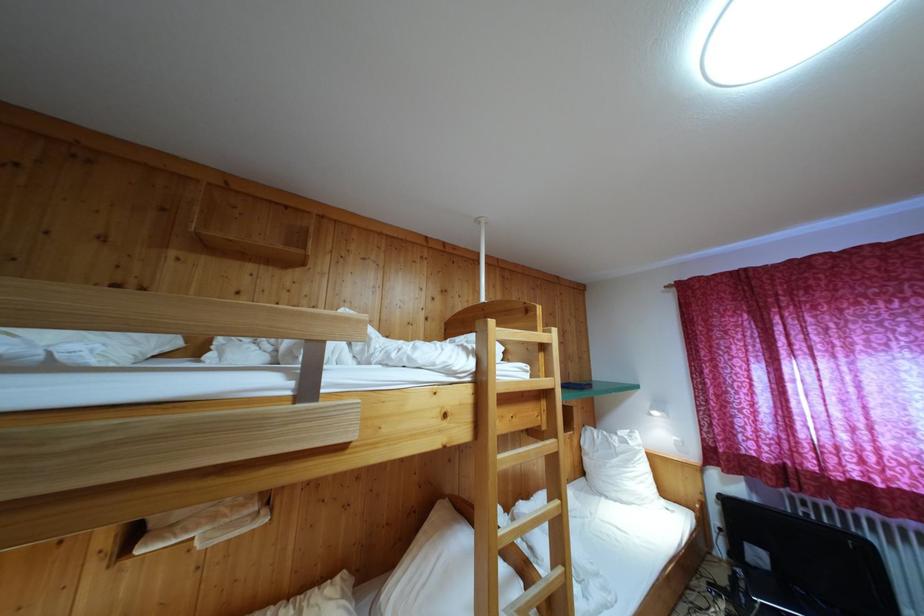
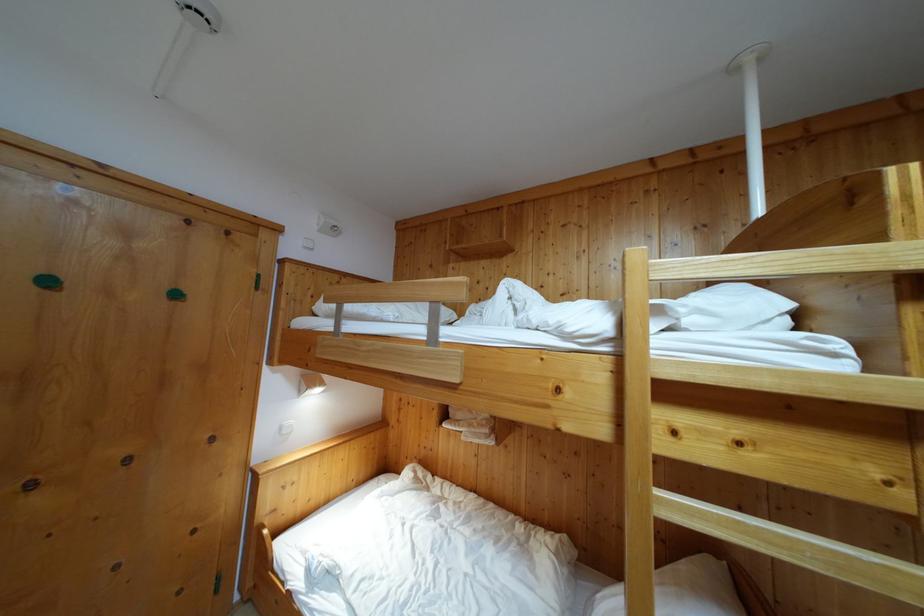
In the second image, find the point that corresponds to point 503,464 in the first image.

(663, 500)